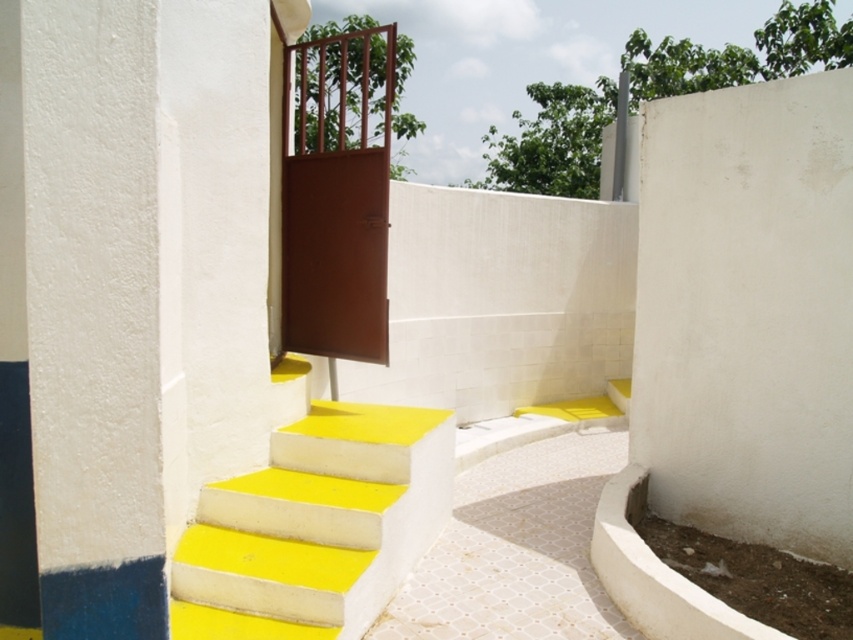
Question: Which of the following is the farthest from the observer?

Choices:
 (A) brown matte door at center
 (B) yellow painted concrete stairs at center

Answer: (A)

Question: Among these objects, which one is nearest to the camera?

Choices:
 (A) white smooth pillar at left
 (B) brown matte door at center

Answer: (A)

Question: Which point is farther to the camera?

Choices:
 (A) (27, 246)
 (B) (361, 332)
 (C) (329, 554)

Answer: (B)

Question: Is yellow painted concrete stairs at center positioned behind brown matte door at center?

Choices:
 (A) yes
 (B) no

Answer: (B)

Question: Is white smooth pillar at left below yellow painted concrete stairs at center?

Choices:
 (A) no
 (B) yes

Answer: (A)

Question: Can you confirm if yellow painted concrete stairs at center is positioned below brown matte door at center?

Choices:
 (A) no
 (B) yes

Answer: (B)